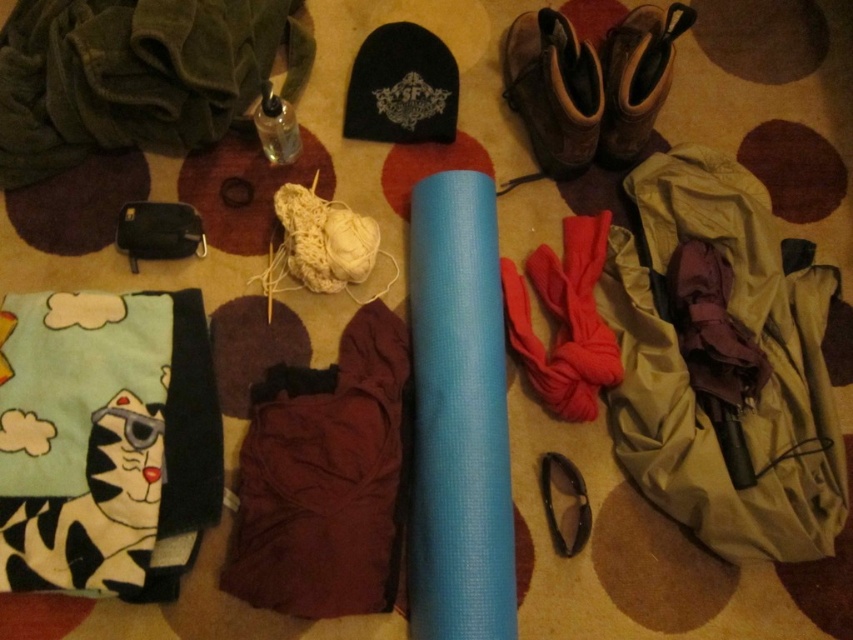
You are packing a small backpack that can only fit items smaller than the burgundy fabric at center. You see the brown suede boot at upper right. Can it fit in the backpack?

The brown suede boot at upper right is smaller than the burgundy fabric at center, so it can fit in the backpack.

What is located at the point marked by coordinates (326, 477) in the image?

The point marked by coordinates (326, 477) is located at the center and marks the burgundy fabric.

You are looking at the image and want to pick up an item from the closest point to you. Which point should you choose between point (x=245, y=456) and point (x=531, y=32)?

Point (x=245, y=456) is closer to the camera than point (x=531, y=32), so you should choose point (x=245, y=456).